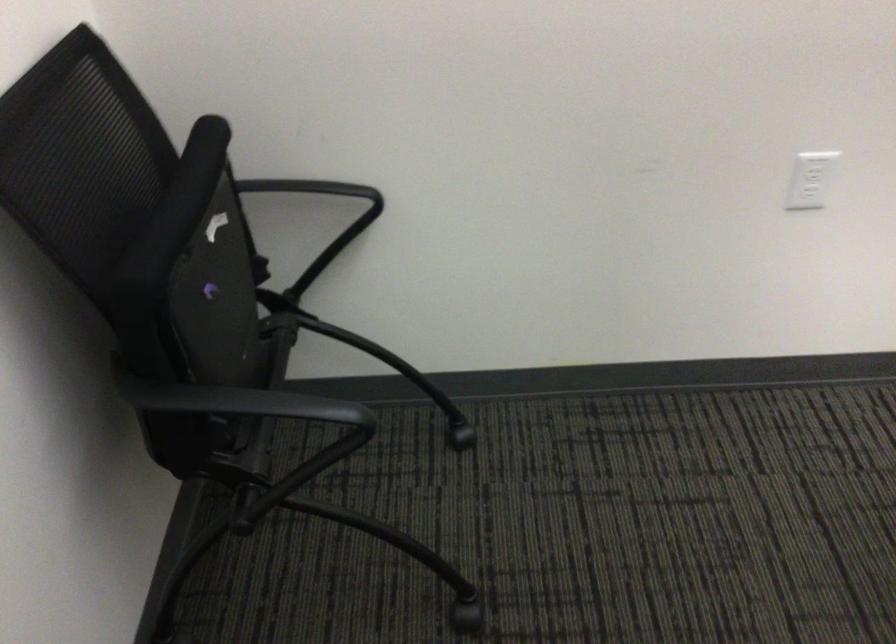
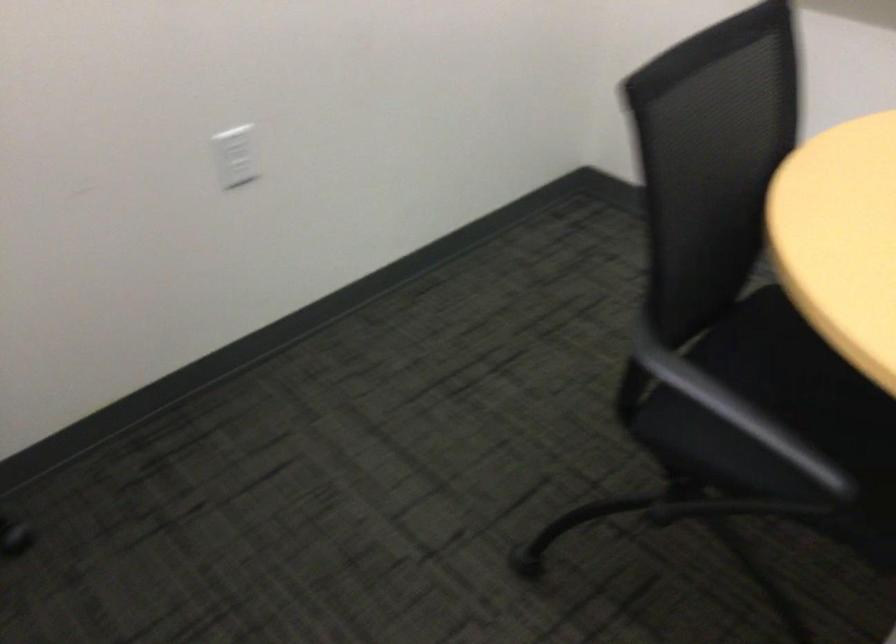
Question: The images are taken continuously from a first-person perspective. In which direction is your viewpoint rotating?

Choices:
 (A) Left
 (B) Right
 (C) Up
 (D) Down

Answer: (B)